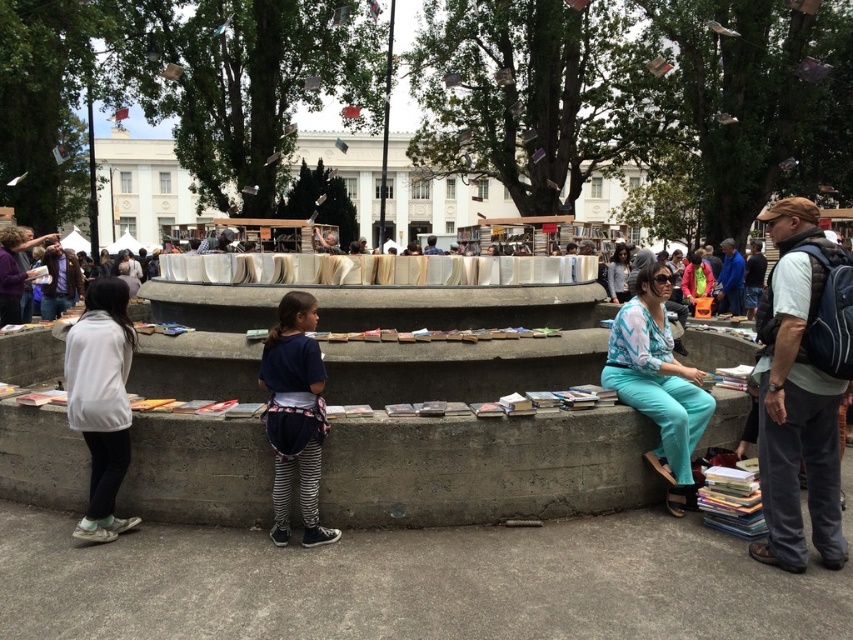
Based on the photo, you are standing in front of the book stall and notice two pairs of pants displayed on the structure. The dark gray pants at right and the teal fabric pants at center. Which pair is positioned higher up?

The dark gray pants at right is located above the teal fabric pants at center, so the dark gray pants at right are positioned higher up.

You are a photographer trying to capture both the white matte jacket at left and the dark blue jersey at center in a single frame. Based on their sizes, which person should you position closer to the camera to ensure both appear equally sized in the photo?

Since the white matte jacket at left is narrower than the dark blue jersey at center, you should position the person in the white matte jacket at left closer to the camera to balance their apparent sizes.

You are standing at the base of the book stall and want to approach the teal fabric pants at center. Which direction should you walk to reach them?

To reach the teal fabric pants at center, walk towards the center of the book stall structure since they are located at point 0.597 on the x and 0.771 on the y coordinates, which places them centrally within the scene.